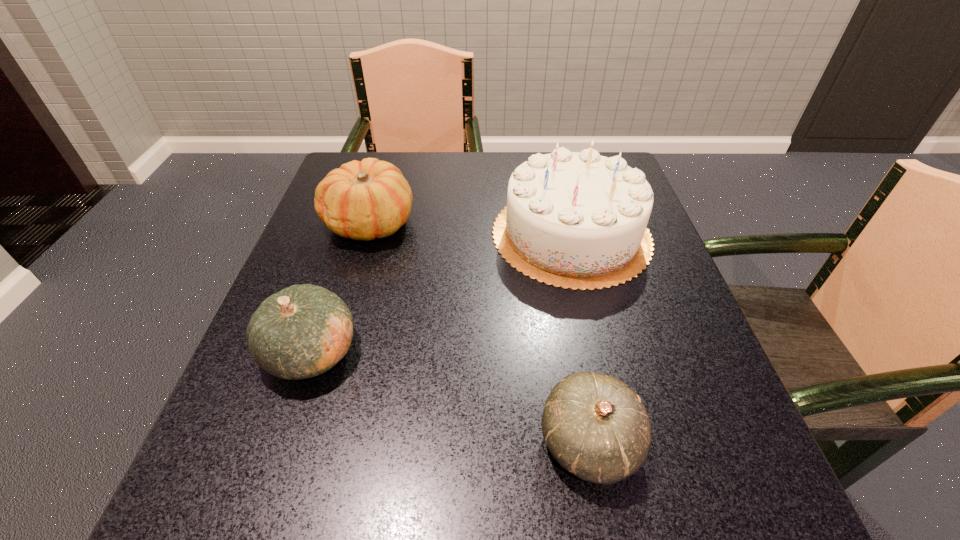
Where is `birthday cake`? birthday cake is located at coordinates (577, 220).

The height and width of the screenshot is (540, 960). I want to click on the second farthest gourd, so click(302, 331).

Where is `the farthest gourd`? The image size is (960, 540). the farthest gourd is located at coordinates (370, 199).

Image resolution: width=960 pixels, height=540 pixels. What are the coordinates of `the shortest gourd` in the screenshot? It's located at (597, 428).

At what (x,y) coordinates should I click in order to perform the action: click on the shortest object. Please return your answer as a coordinate pair (x, y). The width and height of the screenshot is (960, 540). Looking at the image, I should click on (597, 428).

I want to click on free space located on the back of the tallest object, so click(555, 165).

The height and width of the screenshot is (540, 960). Find the location of `vacant space located 0.200m on the right of the third farthest object`. vacant space located 0.200m on the right of the third farthest object is located at coordinates (478, 352).

This screenshot has height=540, width=960. In order to click on blank space located on the front of the farthest gourd in this screenshot , I will do `click(333, 345)`.

The width and height of the screenshot is (960, 540). In order to click on vacant space located on the left of the shortest object in this screenshot , I will do `click(397, 442)`.

You are a GUI agent. You are given a task and a screenshot of the screen. Output one action in this format:
    pyautogui.click(x=<x>, y=<y>)
    Task: Click on the birthday cake present at the far edge
    
    Given the screenshot: What is the action you would take?
    pyautogui.click(x=577, y=220)